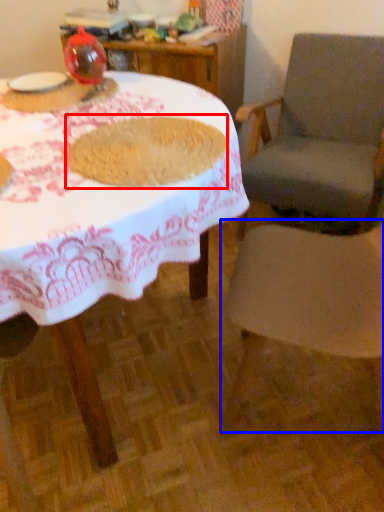
Question: Which point is closer to the camera, food (highlighted by a red box) or chair (highlighted by a blue box)?

Choices:
 (A) food
 (B) chair

Answer: (B)